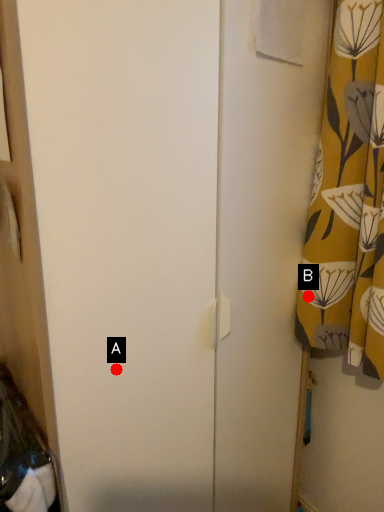
Question: Two points are circled on the image, labeled by A and B beside each circle. Which point appears farthest from the camera in this image?

Choices:
 (A) A is further
 (B) B is further

Answer: (B)